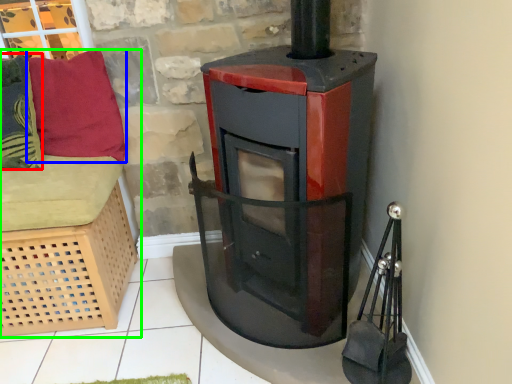
Question: Based on their relative distances, which object is farther from pillow (highlighted by a red box)? Choose from pillow (highlighted by a blue box) and furniture (highlighted by a green box).

Choices:
 (A) pillow
 (B) furniture

Answer: (B)